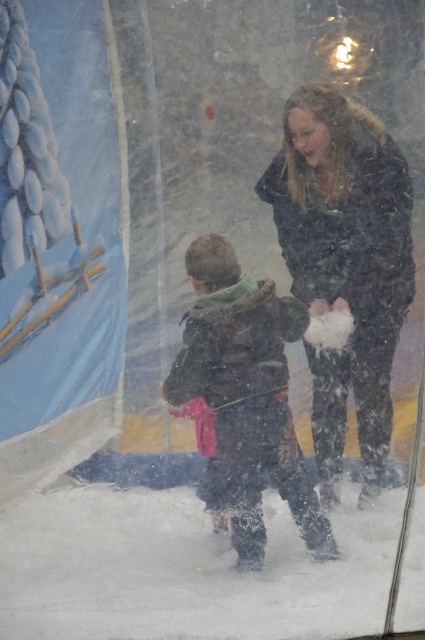
Who is taller, dark brown jacket at center or dark green fuzzy jacket at center?

With more height is dark brown jacket at center.

Can you confirm if dark brown jacket at center is wider than dark green fuzzy jacket at center?

No.

Does point (359, 310) come farther from viewer compared to point (246, 493)?

No, it is in front of (246, 493).

You are a GUI agent. You are given a task and a screenshot of the screen. Output one action in this format:
    pyautogui.click(x=<x>, y=<y>)
    Task: Click on the dark brown jacket at center
    
    Given the screenshot: What is the action you would take?
    pyautogui.click(x=345, y=264)